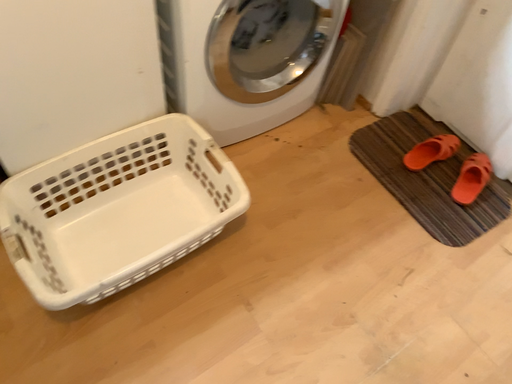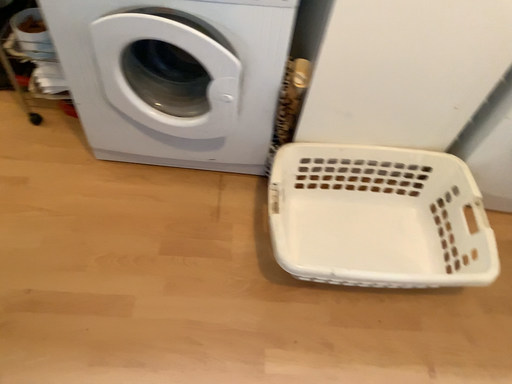
Question: Which way did the camera rotate in the video?

Choices:
 (A) rotated left
 (B) rotated right

Answer: (A)